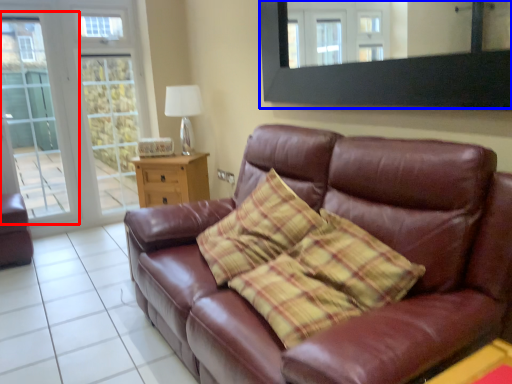
Question: Which point is further to the camera, screen door (highlighted by a red box) or mirror (highlighted by a blue box)?

Choices:
 (A) screen door
 (B) mirror

Answer: (A)